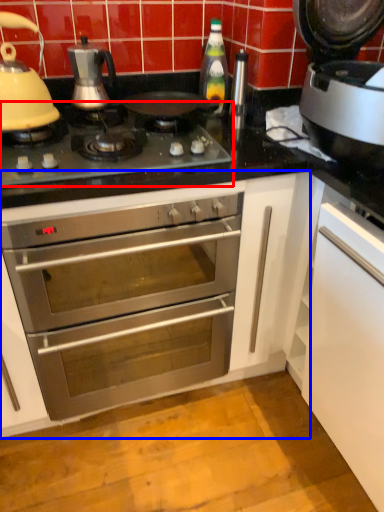
Question: Which point is closer to the camera, gas stove (highlighted by a red box) or cabinetry (highlighted by a blue box)?

Choices:
 (A) gas stove
 (B) cabinetry

Answer: (B)